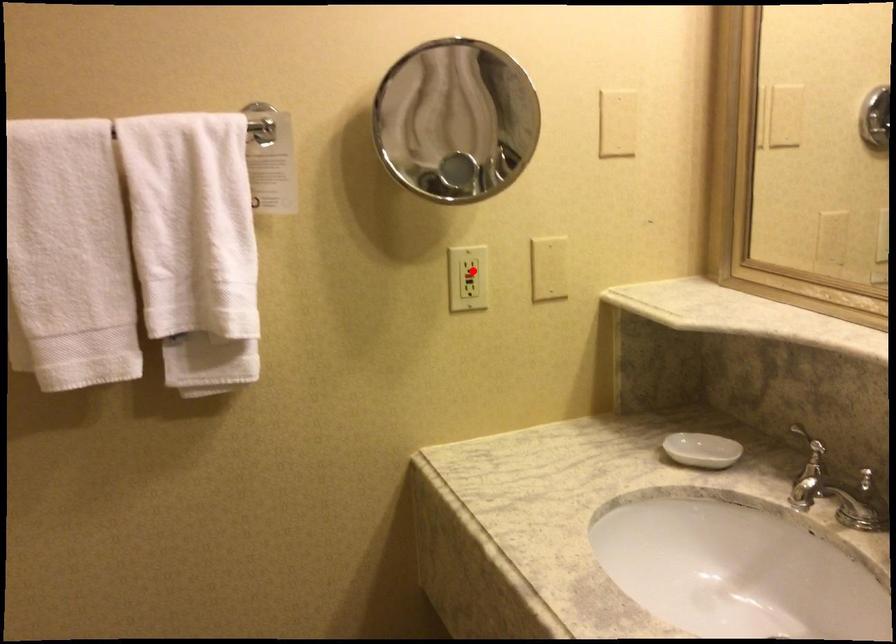
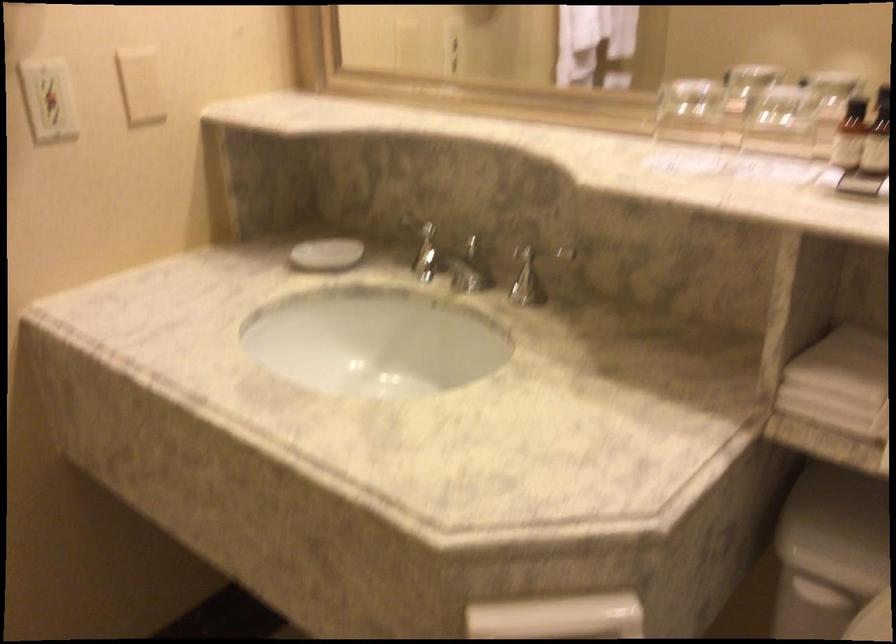
The point at the highlighted location is marked in the first image. Where is the corresponding point in the second image?

(47, 99)